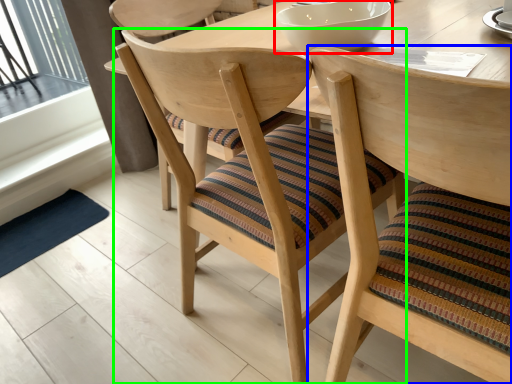
Question: Which is nearer to the bowl (highlighted by a red box)? chair (highlighted by a blue box) or chair (highlighted by a green box).

Choices:
 (A) chair
 (B) chair

Answer: (B)